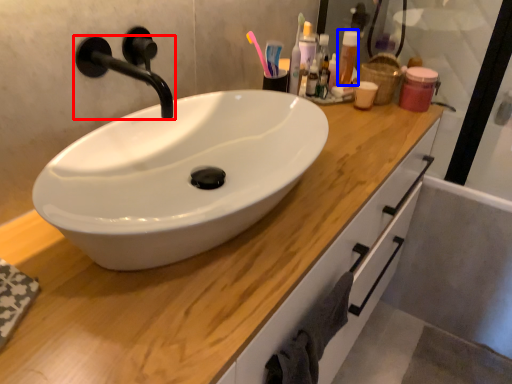
Question: Among these objects, which one is nearest to the camera, tap (highlighted by a red box) or toiletry (highlighted by a blue box)?

Choices:
 (A) tap
 (B) toiletry

Answer: (A)